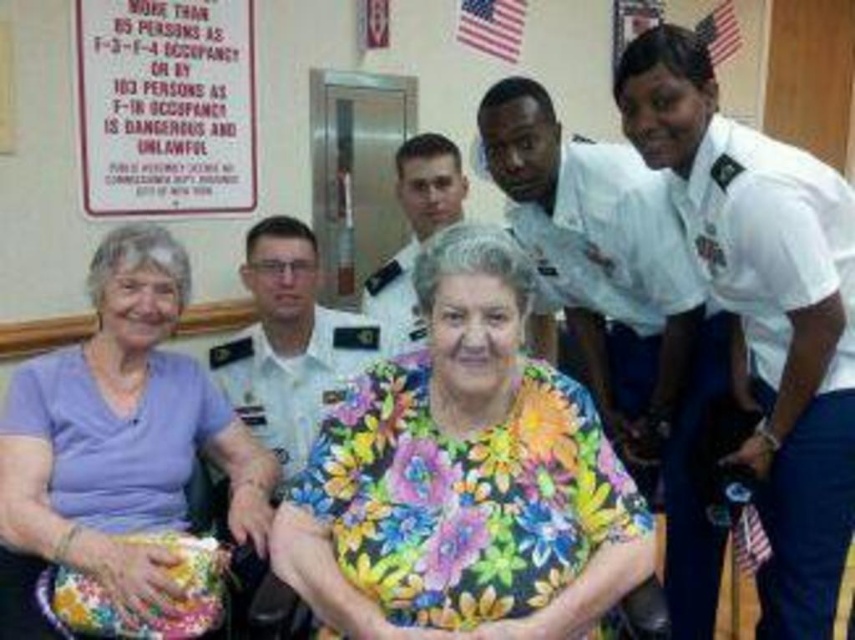
Question: Is floral fabric shirt at center to the right of floral fabric dress at center from the viewer's perspective?

Choices:
 (A) yes
 (B) no

Answer: (A)

Question: Can you confirm if floral fabric shirt at center is thinner than floral fabric dress at center?

Choices:
 (A) no
 (B) yes

Answer: (A)

Question: Which object is the closest to the floral fabric dress at center?

Choices:
 (A) white uniform at center
 (B) white uniform shirt at center

Answer: (B)

Question: Is floral fabric shirt at center above white uniform at center?

Choices:
 (A) no
 (B) yes

Answer: (A)

Question: Among these objects, which one is nearest to the camera?

Choices:
 (A) floral fabric dress at center
 (B) white uniform at upper right

Answer: (A)

Question: Which object appears closest to the camera in this image?

Choices:
 (A) white uniform shirt at center
 (B) white uniform at center
 (C) white uniform at upper right

Answer: (B)